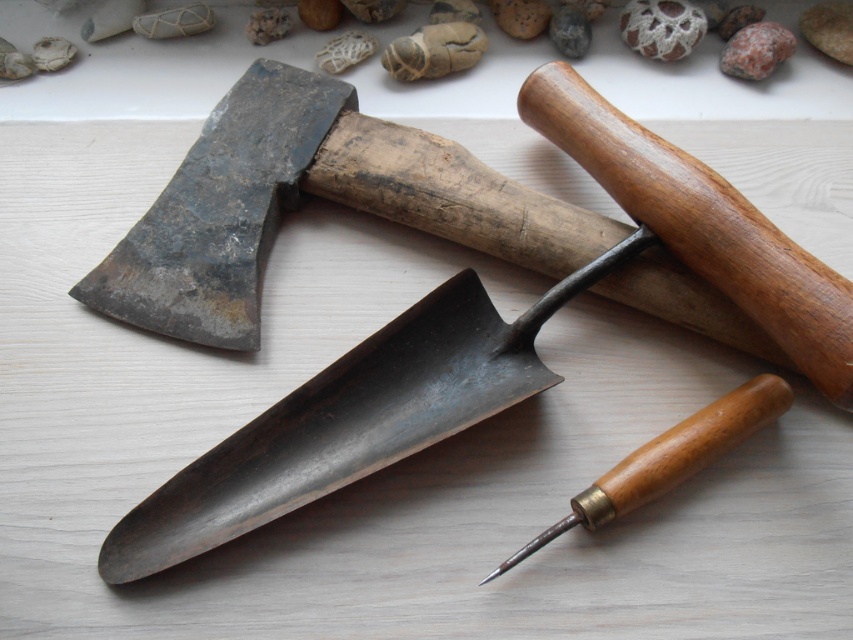
In the scene shown: Is wooden handle chisel at lower right further to the viewer compared to smooth brown rock at upper center?

No, wooden handle chisel at lower right is in front of smooth brown rock at upper center.

Does point (782, 403) come farther from viewer compared to point (698, 20)?

No, (782, 403) is closer to viewer.

Is point (653, 470) more distant than point (695, 35)?

No, it is in front of (695, 35).

What are the coordinates of `wooden handle chisel at lower right` in the screenshot? It's located at (668, 458).

Is wooden handle chisel at lower right further to camera compared to marble-like stone at upper center?

No, it is in front of marble-like stone at upper center.

Does wooden handle chisel at lower right have a lesser height compared to marble-like stone at upper center?

Incorrect, wooden handle chisel at lower right's height does not fall short of marble-like stone at upper center's.

What do you see at coordinates (668, 458) in the screenshot? I see `wooden handle chisel at lower right` at bounding box center [668, 458].

Find the location of a particular element. wooden handle chisel at lower right is located at coordinates (668, 458).

Between smooth brown rock at upper center and marble-like stone at upper center, which one is positioned higher?

smooth brown rock at upper center is above.

Identify the location of smooth brown rock at upper center. The width and height of the screenshot is (853, 640). (660, 28).